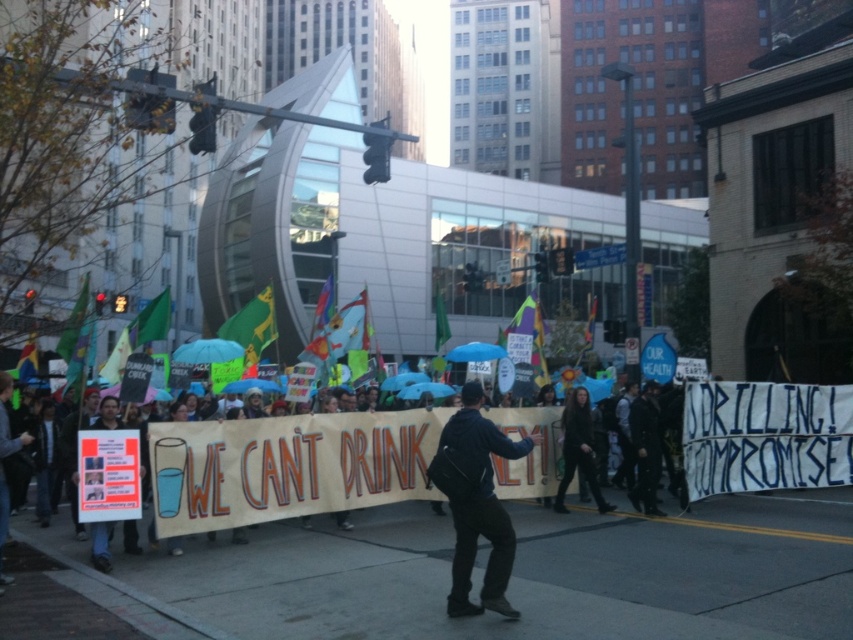
You are a photographer at the protest. You want to capture a clear photo of the brown cardboard banner at center without any obstruction. Can you adjust your position to avoid the dark blue jacket at center?

The brown cardboard banner at center is positioned under the dark blue jacket at center, so adjusting your angle or moving slightly to the side should allow you to capture the banner without obstruction from the jacket.

You are a photographer standing at the edge of the protest. You want to capture a clear photo of the brown cardboard banner at center. The camera you are using has a minimum focusing distance of 10 meters. Will you be able to take a clear photo of the banner?

The brown cardboard banner at center is 9.33 meters away from the viewer. Since the camera requires a minimum focusing distance of 10 meters, the photographer is too close to the banner to take a clear photo.